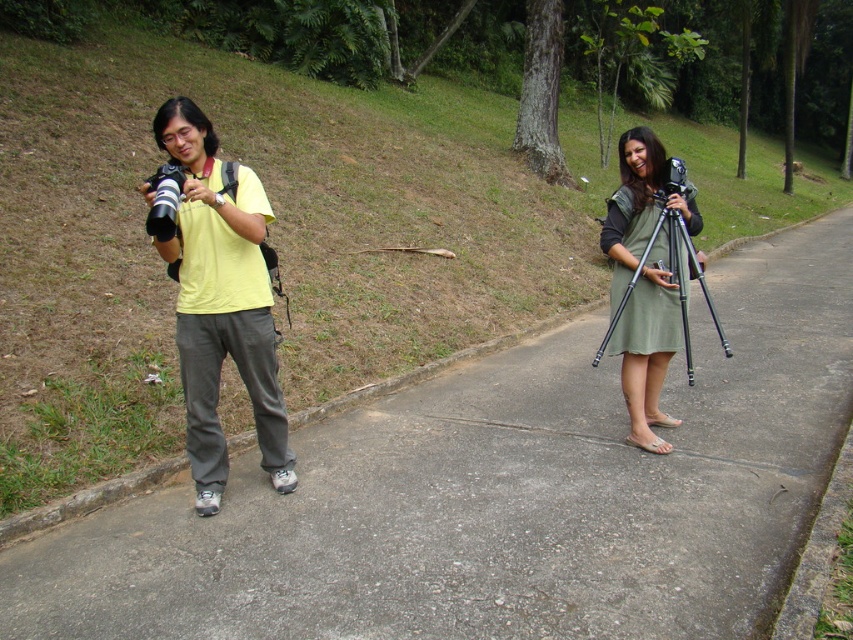
Question: Which of the following is the farthest from the observer?

Choices:
 (A) tap(693, 481)
 (B) tap(285, 472)
 (C) tap(152, 180)

Answer: (A)

Question: Which object is closer to the camera taking this photo?

Choices:
 (A) yellow matte shirt at left
 (B) black matte tripod at right
 (C) gray concrete pavement at center

Answer: (C)

Question: Is yellow matte shirt at left below matte black camera at left?

Choices:
 (A) yes
 (B) no

Answer: (A)

Question: Can you confirm if gray concrete pavement at center is thinner than yellow matte shirt at left?

Choices:
 (A) yes
 (B) no

Answer: (B)

Question: Can you confirm if gray concrete pavement at center is positioned above yellow matte shirt at left?

Choices:
 (A) yes
 (B) no

Answer: (B)

Question: Which of the following is the farthest from the observer?

Choices:
 (A) (152, 228)
 (B) (624, 426)
 (C) (686, 234)

Answer: (B)